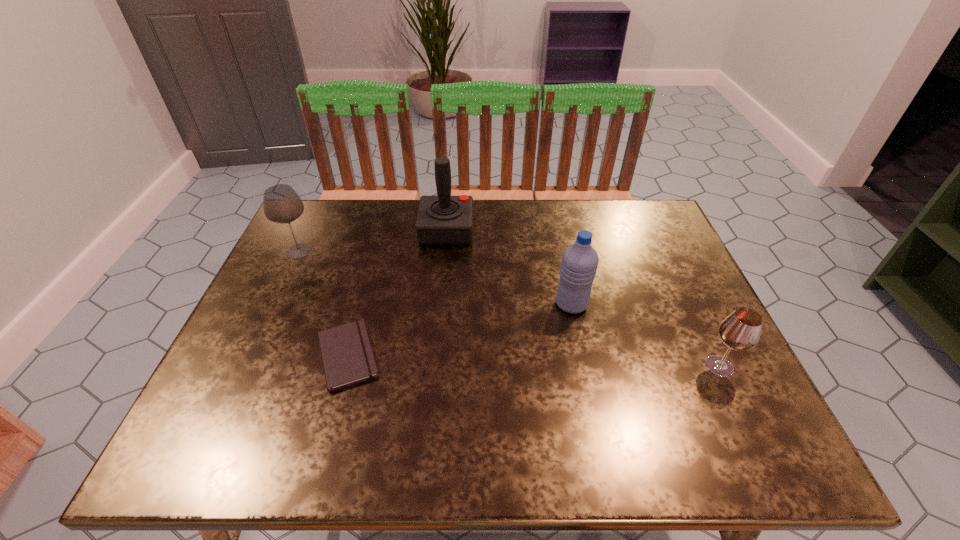
Find the location of a particular element. empty space that is in between the fourth tallest object and the left wineglass is located at coordinates (509, 309).

I want to click on free point between the third object from left to right and the farther wineglass, so pos(372,240).

Find the location of a particular element. The width and height of the screenshot is (960, 540). vacant area between the checkbook and the farther wineglass is located at coordinates (324, 303).

This screenshot has height=540, width=960. Find the location of `vacant space that is in between the checkbook and the left wineglass`. vacant space that is in between the checkbook and the left wineglass is located at coordinates (324, 303).

Locate an element on the screen. object that ranks as the third closest to the joystick is located at coordinates (347, 357).

Locate an element on the screen. The height and width of the screenshot is (540, 960). the second closest object to the fourth object from right to left is located at coordinates (443, 219).

The height and width of the screenshot is (540, 960). Identify the location of free space that satisfies the following two spatial constraints: 1. on the base of the third object from left to right; 2. on the back side of the shorter wineglass. (434, 367).

The height and width of the screenshot is (540, 960). Identify the location of vacant point that satisfies the following two spatial constraints: 1. on the front side of the water bottle; 2. on the left side of the taller wineglass. (275, 304).

The image size is (960, 540). I want to click on free spot that satisfies the following two spatial constraints: 1. on the base of the joystick; 2. on the left side of the water bottle, so click(440, 304).

At what (x,y) coordinates should I click in order to perform the action: click on vacant space that satisfies the following two spatial constraints: 1. on the base of the third object from right to left; 2. on the back side of the rightmost object. Please return your answer as a coordinate pair (x, y). Looking at the image, I should click on (434, 367).